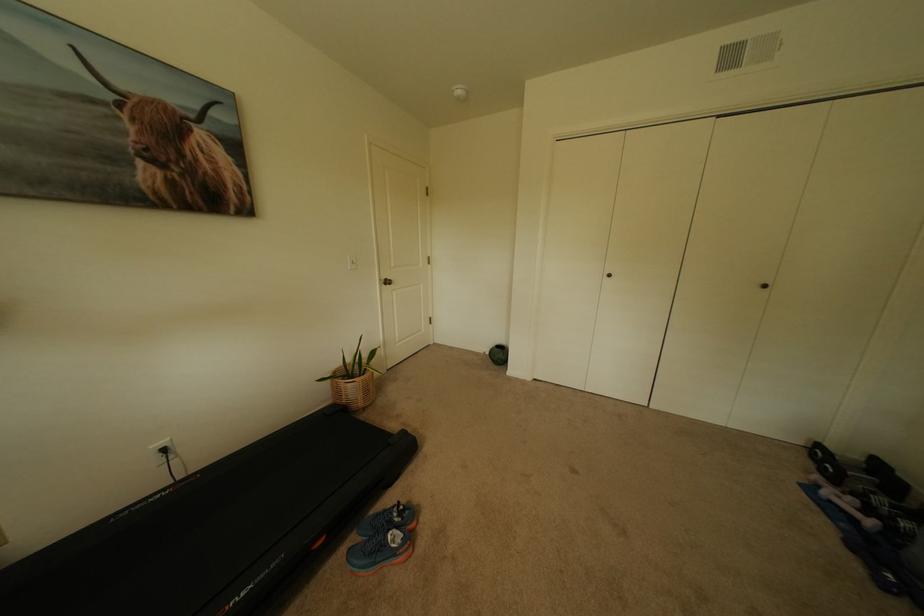
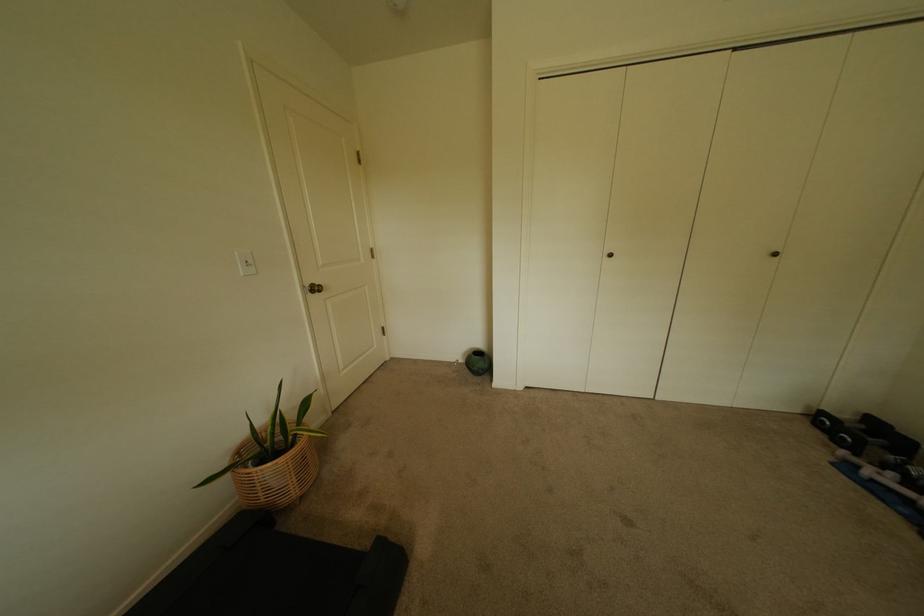
Where in the second image is the point corresponding to (391,280) from the first image?

(315, 286)